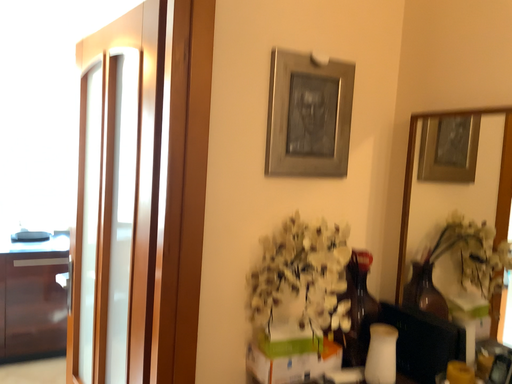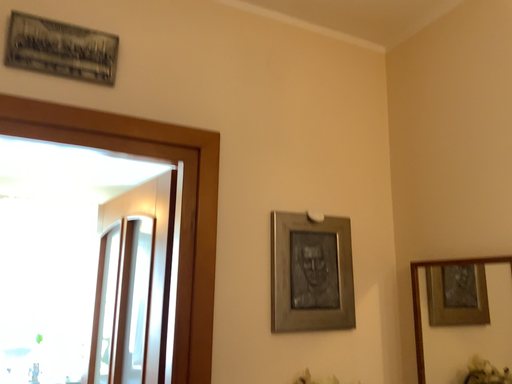
Question: How did the camera likely rotate when shooting the video?

Choices:
 (A) rotated downward
 (B) rotated upward

Answer: (B)